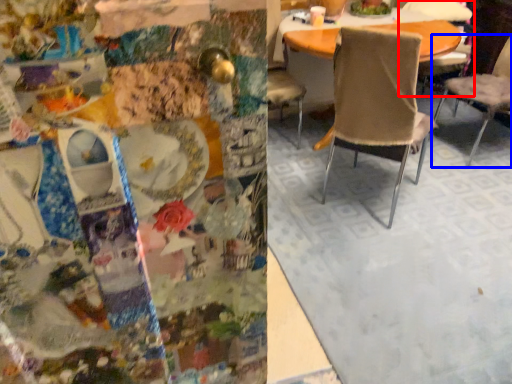
Question: Which point is closer to the camera, chair (highlighted by a red box) or chair (highlighted by a blue box)?

Choices:
 (A) chair
 (B) chair

Answer: (B)